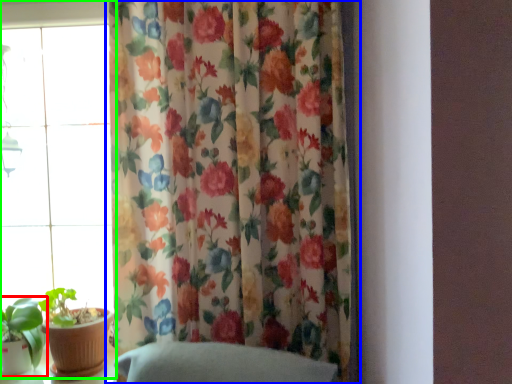
Question: Which object is positioned closest to houseplant (highlighted by a red box)? Select from curtain (highlighted by a blue box) and window (highlighted by a green box).

Choices:
 (A) curtain
 (B) window

Answer: (B)